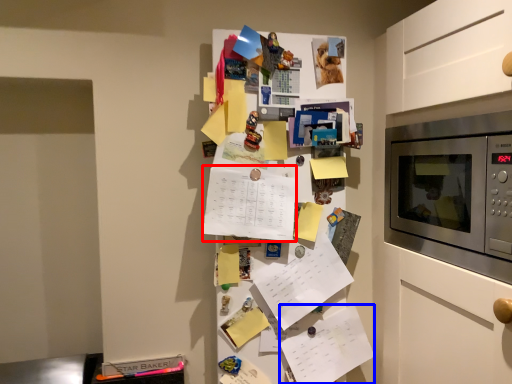
Question: Which point is closer to the camera, list (highlighted by a red box) or list (highlighted by a blue box)?

Choices:
 (A) list
 (B) list

Answer: (A)